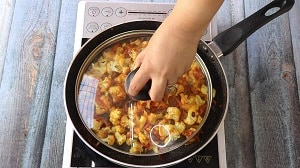
Locate an element on the screen. table is located at coordinates (42, 81).